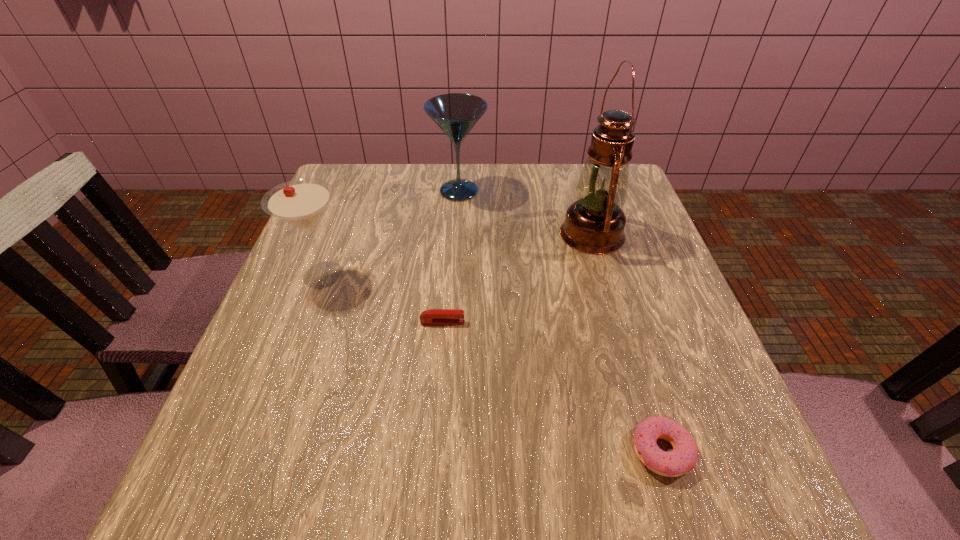
Image resolution: width=960 pixels, height=540 pixels. In order to click on free space between the stapler and the farther martini in this screenshot , I will do point(451,256).

Locate an element on the screen. This screenshot has width=960, height=540. free space that is in between the farther martini and the second nearest object is located at coordinates (451, 256).

Identify the location of free space between the stapler and the oil lamp. This screenshot has height=540, width=960. (517, 278).

Locate an element on the screen. vacant space in between the right martini and the leftmost object is located at coordinates (392, 233).

Locate which object is the closest to the nearer martini. Please provide its 2D coordinates. Your answer should be formatted as a tuple, i.e. [(x, y)], where the tuple contains the x and y coordinates of a point satisfying the conditions above.

[(433, 316)]

The image size is (960, 540). I want to click on object that is the nearest to the tallest object, so click(456, 114).

You are a GUI agent. You are given a task and a screenshot of the screen. Output one action in this format:
    pyautogui.click(x=<x>, y=<y>)
    Task: Click on the free space that satisfies the following two spatial constraints: 1. on the front side of the right martini; 2. on the right side of the nearest object
    Image resolution: width=960 pixels, height=540 pixels.
    Given the screenshot: What is the action you would take?
    pyautogui.click(x=443, y=451)

At what (x,y) coordinates should I click in order to perform the action: click on vacant space that satisfies the following two spatial constraints: 1. on the front side of the tallest object; 2. on the left side of the nearest object. Please return your answer as a coordinate pair (x, y). Looking at the image, I should click on (656, 451).

You are a GUI agent. You are given a task and a screenshot of the screen. Output one action in this format:
    pyautogui.click(x=<x>, y=<y>)
    Task: Click on the blank space that satisfies the following two spatial constraints: 1. on the front-facing side of the doughnut; 2. on the left side of the fourth farthest object
    The width and height of the screenshot is (960, 540).
    Given the screenshot: What is the action you would take?
    pyautogui.click(x=432, y=451)

You are a GUI agent. You are given a task and a screenshot of the screen. Output one action in this format:
    pyautogui.click(x=<x>, y=<y>)
    Task: Click on the free space in the image that satisfies the following two spatial constraints: 1. on the front side of the oil lamp; 2. on the front-facing side of the stapler
    
    Given the screenshot: What is the action you would take?
    pyautogui.click(x=618, y=322)